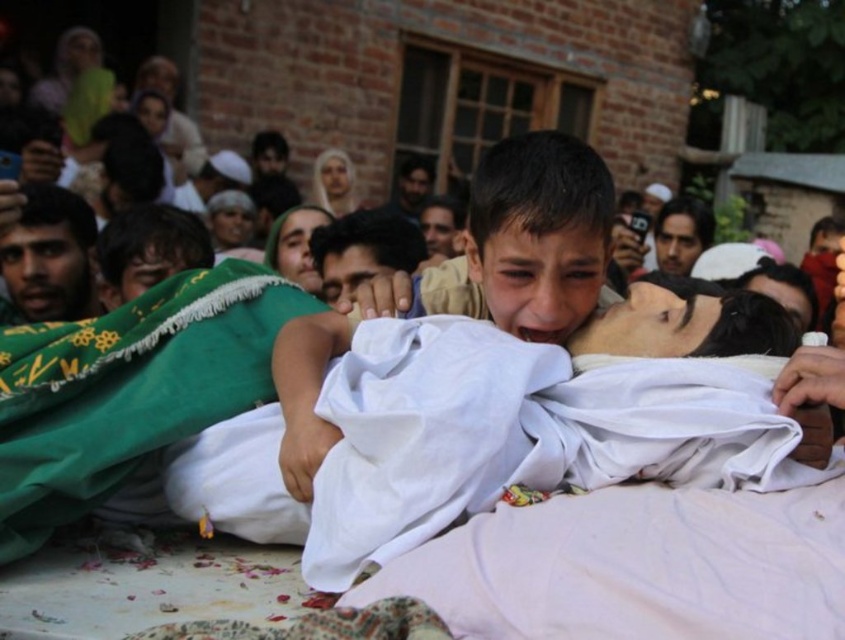
Question: Is the position of green fabric blanket at center more distant than that of dark green fabric at left?

Choices:
 (A) yes
 (B) no

Answer: (B)

Question: Which point appears closest to the camera in this image?

Choices:
 (A) (428, 252)
 (B) (398, 200)
 (C) (48, 528)

Answer: (C)

Question: Among these points, which one is nearest to the camera?

Choices:
 (A) pyautogui.click(x=682, y=266)
 (B) pyautogui.click(x=429, y=177)
 (C) pyautogui.click(x=434, y=248)

Answer: (C)

Question: Can you confirm if green fabric blanket at center is thinner than smooth skin face at upper center?

Choices:
 (A) no
 (B) yes

Answer: (A)

Question: Which of the following is the closest to the observer?

Choices:
 (A) smooth white cloth at center
 (B) smooth skin face at upper center

Answer: (A)

Question: Does green fabric blanket at center appear over dark brown skin at left?

Choices:
 (A) yes
 (B) no

Answer: (B)